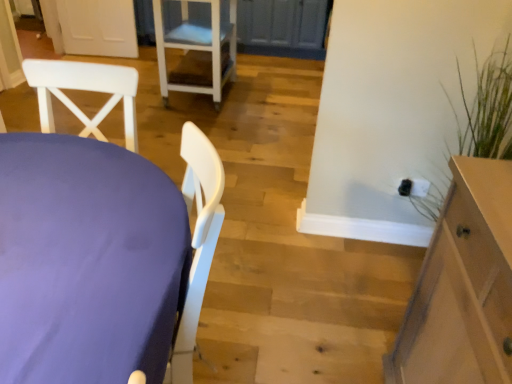
Question: Is purple fabric table at left bigger than white plastic chair at upper center?

Choices:
 (A) yes
 (B) no

Answer: (B)

Question: Is purple fabric table at left located outside white plastic chair at upper center?

Choices:
 (A) no
 (B) yes

Answer: (B)

Question: Is purple fabric table at left thinner than white plastic chair at upper center?

Choices:
 (A) no
 (B) yes

Answer: (B)

Question: Is the depth of purple fabric table at left greater than that of white plastic chair at upper center?

Choices:
 (A) yes
 (B) no

Answer: (B)

Question: From a real-world perspective, is purple fabric table at left under white plastic chair at upper center?

Choices:
 (A) no
 (B) yes

Answer: (A)

Question: Considering the positions of purple fabric table at left and white plastic chair at upper center in the image, is purple fabric table at left wider or thinner than white plastic chair at upper center?

Choices:
 (A) thin
 (B) wide

Answer: (A)

Question: Is point (41, 327) positioned closer to the camera than point (168, 31)?

Choices:
 (A) closer
 (B) farther

Answer: (A)

Question: Looking at the image, does purple fabric table at left seem bigger or smaller compared to white plastic chair at upper center?

Choices:
 (A) small
 (B) big

Answer: (A)

Question: From a real-world perspective, is purple fabric table at left above or below white plastic chair at upper center?

Choices:
 (A) above
 (B) below

Answer: (A)

Question: Looking at the image, does white plastic chair at upper center seem bigger or smaller compared to light brown wood cabinet at right?

Choices:
 (A) big
 (B) small

Answer: (A)

Question: Considering the positions of white plastic chair at upper center and light brown wood cabinet at right in the image, is white plastic chair at upper center taller or shorter than light brown wood cabinet at right?

Choices:
 (A) tall
 (B) short

Answer: (B)

Question: In the image, is white plastic chair at upper center on the left side or the right side of light brown wood cabinet at right?

Choices:
 (A) left
 (B) right

Answer: (A)

Question: Considering the positions of white plastic chair at upper center and light brown wood cabinet at right in the image, is white plastic chair at upper center wider or thinner than light brown wood cabinet at right?

Choices:
 (A) thin
 (B) wide

Answer: (B)

Question: Is purple fabric table at left spatially inside light brown wood cabinet at right, or outside of it?

Choices:
 (A) inside
 (B) outside

Answer: (B)

Question: Is purple fabric table at left to the left or to the right of light brown wood cabinet at right in the image?

Choices:
 (A) right
 (B) left

Answer: (B)